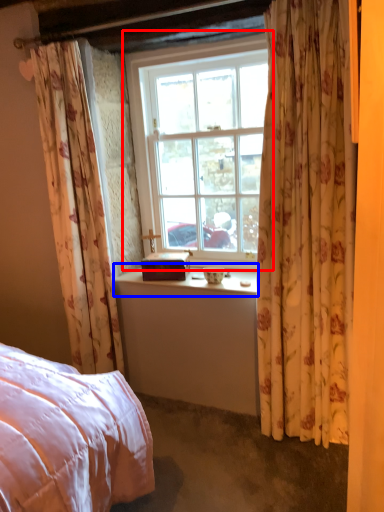
Question: Which object appears closest to the camera in this image, window (highlighted by a red box) or window sill (highlighted by a blue box)?

Choices:
 (A) window
 (B) window sill

Answer: (A)